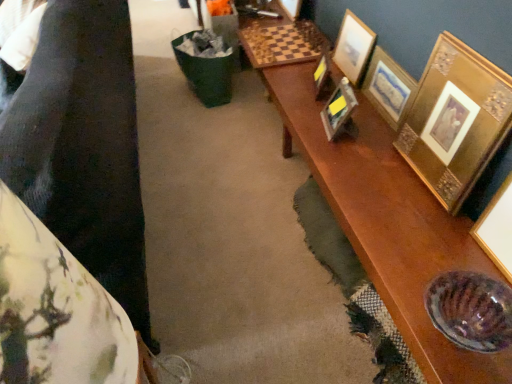
Question: Considering the relative positions of gold metallic picture frame at upper right, which ranks as the fifth picture frame in right-to-left order, and metallic gold picture frame at center, which is the second picture frame from left to right, in the image provided, is gold metallic picture frame at upper right, which ranks as the fifth picture frame in right-to-left order, in front of metallic gold picture frame at center, which is the second picture frame from left to right,?

Choices:
 (A) no
 (B) yes

Answer: (A)

Question: Are gold metallic picture frame at upper right, the 1th picture frame from the left, and metallic gold picture frame at center, acting as the 4th picture frame starting from the right, far apart?

Choices:
 (A) yes
 (B) no

Answer: (B)

Question: Considering the relative positions of gold metallic picture frame at upper right, which ranks as the fifth picture frame in right-to-left order, and metallic gold picture frame at center, acting as the 4th picture frame starting from the right, in the image provided, is gold metallic picture frame at upper right, which ranks as the fifth picture frame in right-to-left order, to the left of metallic gold picture frame at center, acting as the 4th picture frame starting from the right, from the viewer's perspective?

Choices:
 (A) no
 (B) yes

Answer: (B)

Question: Considering the relative sizes of gold metallic picture frame at upper right, the 1th picture frame from the left, and metallic gold picture frame at center, acting as the 4th picture frame starting from the right, in the image provided, is gold metallic picture frame at upper right, the 1th picture frame from the left, taller than metallic gold picture frame at center, acting as the 4th picture frame starting from the right,?

Choices:
 (A) no
 (B) yes

Answer: (A)

Question: Is gold metallic picture frame at upper right, which ranks as the fifth picture frame in right-to-left order, wider than metallic gold picture frame at center, acting as the 4th picture frame starting from the right?

Choices:
 (A) no
 (B) yes

Answer: (A)

Question: Is gold metallic picture frame at upper right, which ranks as the fifth picture frame in right-to-left order, aimed at metallic gold picture frame at center, which is the second picture frame from left to right?

Choices:
 (A) yes
 (B) no

Answer: (B)

Question: Does gold ornate picture frame at right, the fifth picture frame positioned from the left, appear on the left side of metallic gold picture frame at center, acting as the 4th picture frame starting from the right?

Choices:
 (A) no
 (B) yes

Answer: (A)

Question: Is gold ornate picture frame at right, the fifth picture frame positioned from the left, taller than metallic gold picture frame at center, acting as the 4th picture frame starting from the right?

Choices:
 (A) no
 (B) yes

Answer: (B)

Question: Does gold ornate picture frame at right, the fifth picture frame positioned from the left, have a lesser width compared to metallic gold picture frame at center, acting as the 4th picture frame starting from the right?

Choices:
 (A) no
 (B) yes

Answer: (B)

Question: Can metallic gold picture frame at center, acting as the 4th picture frame starting from the right, be found inside gold ornate picture frame at right, which appears as the 1th picture frame when viewed from the right?

Choices:
 (A) yes
 (B) no

Answer: (B)

Question: Does gold ornate picture frame at right, the fifth picture frame positioned from the left, have a smaller size compared to metallic gold picture frame at center, acting as the 4th picture frame starting from the right?

Choices:
 (A) no
 (B) yes

Answer: (A)

Question: Is gold ornate picture frame at right, the fifth picture frame positioned from the left, not within metallic gold picture frame at center, which is the second picture frame from left to right?

Choices:
 (A) no
 (B) yes

Answer: (B)

Question: From the image's perspective, is gold textured picture frame at upper right, which is the 2th picture frame from right to left, beneath fluffy fabric cushion at left?

Choices:
 (A) no
 (B) yes

Answer: (A)